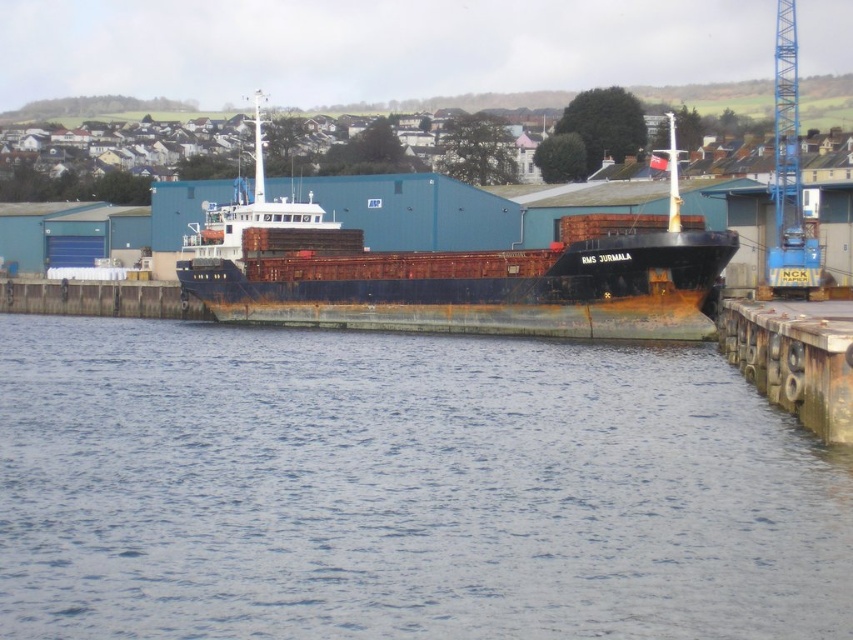
Question: Observing the image, what is the correct spatial positioning of blue water at lower center in reference to rusty wood dock at lower right?

Choices:
 (A) above
 (B) below

Answer: (B)

Question: Which object is closer to the camera taking this photo?

Choices:
 (A) blue metallic crane at upper right
 (B) rusty wood dock at lower right

Answer: (B)

Question: Which point appears farthest from the camera in this image?

Choices:
 (A) (485, 262)
 (B) (13, 448)
 (C) (776, 13)
 (D) (724, 333)

Answer: (C)

Question: Where is blue water at lower center located in relation to blue metallic crane at upper right in the image?

Choices:
 (A) right
 (B) left

Answer: (B)

Question: Which is nearer to the blue metallic crane at upper right?

Choices:
 (A) blue water at lower center
 (B) rusty wood dock at lower right

Answer: (B)

Question: Does rusty metal ship at center have a larger size compared to blue metallic crane at upper right?

Choices:
 (A) no
 (B) yes

Answer: (B)